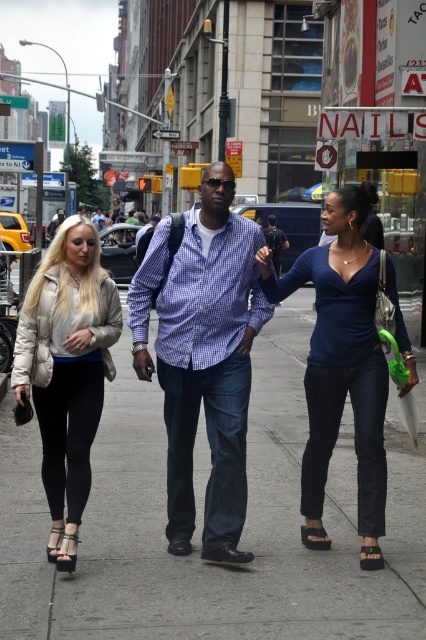
You are standing at the point marked as point (247, 262). You need to walk to the nearest building entrance. Which direction should you go?

The nearest building entrance is located to the north of point (247, 262).

You are a delivery person with a 1.2 meter wide cart. You need to navigate through the street while avoiding obstacles. Can your cart fit between the gray concrete sidewalk at center and the beige puffer jacket at left?

The gray concrete sidewalk at center is wider than the beige puffer jacket at left. Since the cart is 1.2 meters wide, it depends on the exact width of the sidewalk. However, since the sidewalk is wider than the jacket, it might be possible. But without specific measurements, we can only say the sidewalk is wider, so maybe.